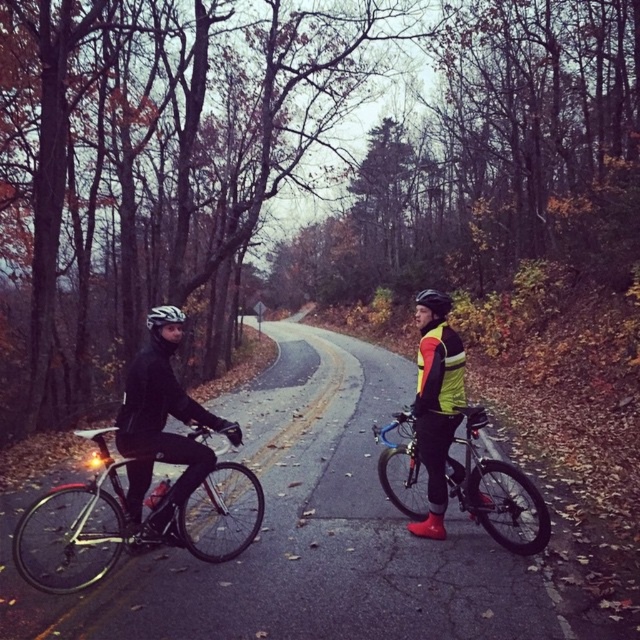
Question: Which of these objects is positioned closest to the yellow reflective safety vest at center?

Choices:
 (A) black matte helmet at center
 (B) shiny metallic bicycle at center
 (C) white matte bicycle helmet at left

Answer: (B)

Question: Does shiny metallic bicycle at center lie in front of black matte helmet at center?

Choices:
 (A) yes
 (B) no

Answer: (A)

Question: Which object appears closest to the camera in this image?

Choices:
 (A) white matte bicycle helmet at left
 (B) black matte helmet at center
 (C) shiny metallic bicycle at center
 (D) yellow reflective safety vest at center

Answer: (C)

Question: Is shiny black bicycle at left above white matte bicycle helmet at left?

Choices:
 (A) no
 (B) yes

Answer: (A)

Question: Is matte black bicycle at left thinner than shiny metallic bicycle at center?

Choices:
 (A) no
 (B) yes

Answer: (A)

Question: Which object appears closest to the camera in this image?

Choices:
 (A) shiny black bicycle at left
 (B) shiny metallic bicycle at center
 (C) black matte helmet at center
 (D) white matte bicycle helmet at left

Answer: (A)